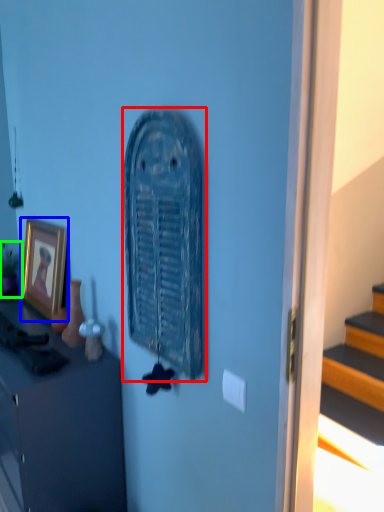
Question: Which object is positioned closest to art (highlighted by a red box)? Select from picture frame (highlighted by a blue box) and houseplant (highlighted by a green box).

Choices:
 (A) picture frame
 (B) houseplant

Answer: (A)